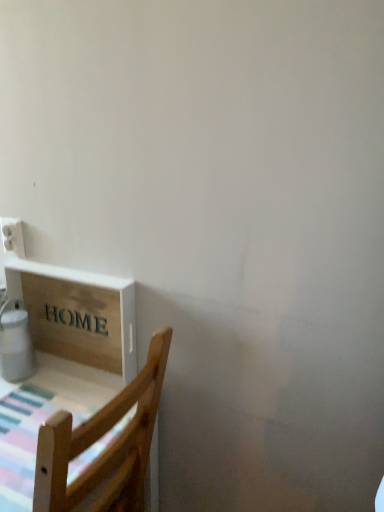
Question: From a real-world perspective, is white plastic electric outlet at upper left on white glossy water heater at lower left?

Choices:
 (A) yes
 (B) no

Answer: (A)

Question: Is white plastic electric outlet at upper left far away from white glossy water heater at lower left?

Choices:
 (A) no
 (B) yes

Answer: (A)

Question: Is white plastic electric outlet at upper left aimed at white glossy water heater at lower left?

Choices:
 (A) no
 (B) yes

Answer: (A)

Question: From the image's perspective, is white plastic electric outlet at upper left above white glossy water heater at lower left?

Choices:
 (A) no
 (B) yes

Answer: (B)

Question: Is white plastic electric outlet at upper left looking in the opposite direction of white glossy water heater at lower left?

Choices:
 (A) no
 (B) yes

Answer: (A)

Question: Is white plastic electric outlet at upper left in front of white glossy water heater at lower left?

Choices:
 (A) yes
 (B) no

Answer: (B)

Question: From a real-world perspective, is white glossy water heater at lower left below white plastic electric outlet at upper left?

Choices:
 (A) yes
 (B) no

Answer: (A)

Question: Considering the relative sizes of white glossy water heater at lower left and white plastic electric outlet at upper left in the image provided, is white glossy water heater at lower left thinner than white plastic electric outlet at upper left?

Choices:
 (A) no
 (B) yes

Answer: (A)

Question: Is white glossy water heater at lower left positioned before white plastic electric outlet at upper left?

Choices:
 (A) yes
 (B) no

Answer: (A)

Question: Considering the relative sizes of white glossy water heater at lower left and white plastic electric outlet at upper left in the image provided, is white glossy water heater at lower left wider than white plastic electric outlet at upper left?

Choices:
 (A) yes
 (B) no

Answer: (A)

Question: Is white glossy water heater at lower left positioned behind white plastic electric outlet at upper left?

Choices:
 (A) no
 (B) yes

Answer: (A)

Question: Considering the relative sizes of white glossy water heater at lower left and white plastic electric outlet at upper left in the image provided, is white glossy water heater at lower left smaller than white plastic electric outlet at upper left?

Choices:
 (A) no
 (B) yes

Answer: (A)

Question: From the image's perspective, would you say white plastic electric outlet at upper left is shown under wooden sign at lower left?

Choices:
 (A) no
 (B) yes

Answer: (A)